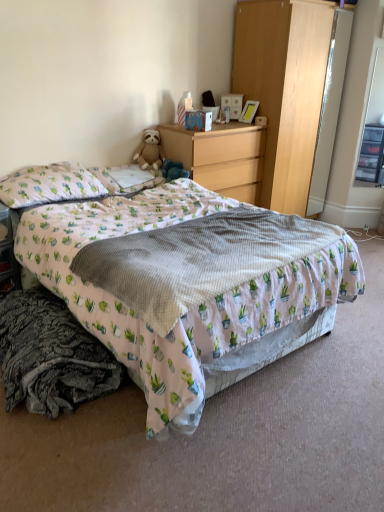
Where is `vacant space underneath matte cardboard box at upper center (from a real-world perspective)`? vacant space underneath matte cardboard box at upper center (from a real-world perspective) is located at coordinates point(196,130).